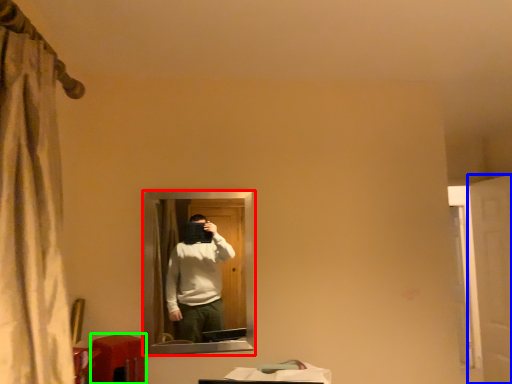
Question: Which object is the closest to the mirror (highlighted by a red box)? Choose among these: screen door (highlighted by a blue box) or table (highlighted by a green box).

Choices:
 (A) screen door
 (B) table

Answer: (B)